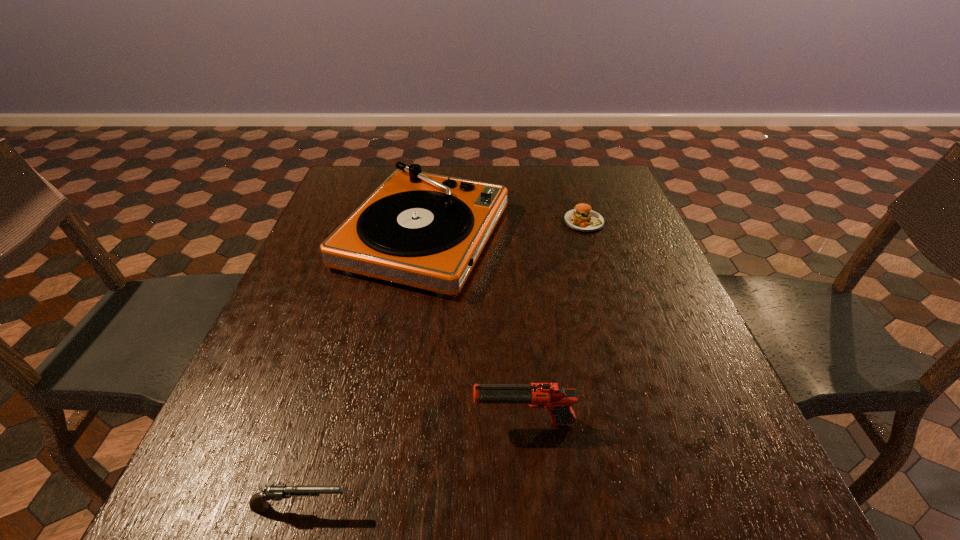
The width and height of the screenshot is (960, 540). Identify the location of vacant space located at the aiming end of the taller gun. (404, 423).

Where is `free space located aiming along the barrel of the third tallest object`? The image size is (960, 540). free space located aiming along the barrel of the third tallest object is located at coordinates (419, 507).

Where is `blank space located on the left of the rightmost object`? blank space located on the left of the rightmost object is located at coordinates (419, 221).

The image size is (960, 540). Identify the location of object located at the far edge. (423, 230).

Where is `object positioned at the near edge`? This screenshot has width=960, height=540. object positioned at the near edge is located at coordinates (258, 502).

Image resolution: width=960 pixels, height=540 pixels. I want to click on record player located at the left edge, so click(x=423, y=230).

Where is `gun at the left edge`? The height and width of the screenshot is (540, 960). gun at the left edge is located at coordinates (258, 502).

This screenshot has width=960, height=540. Find the location of `object at the right edge`. object at the right edge is located at coordinates (582, 218).

Identify the location of object positioned at the far left corner. 423,230.

This screenshot has width=960, height=540. Find the location of `object at the near left corner`. object at the near left corner is located at coordinates (258, 502).